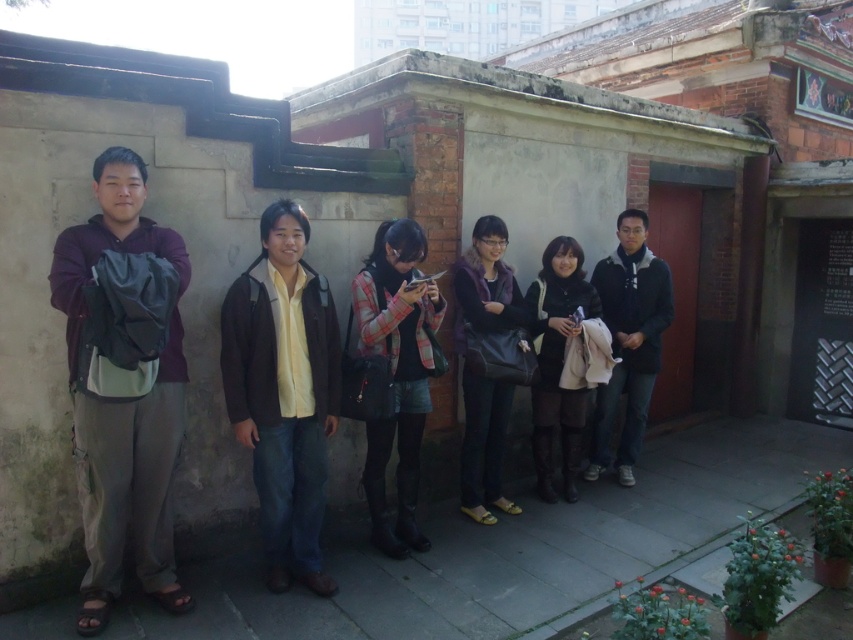
You are standing at the position of the purple fuzzy vest at center and want to take a photo of the traditional building. The camera is 4.48 meters away from you. Can you reach the camera to take the photo without moving from your current position?

The camera is 4.48 meters away from the purple fuzzy vest at center, so you cannot reach it without moving from your current position.